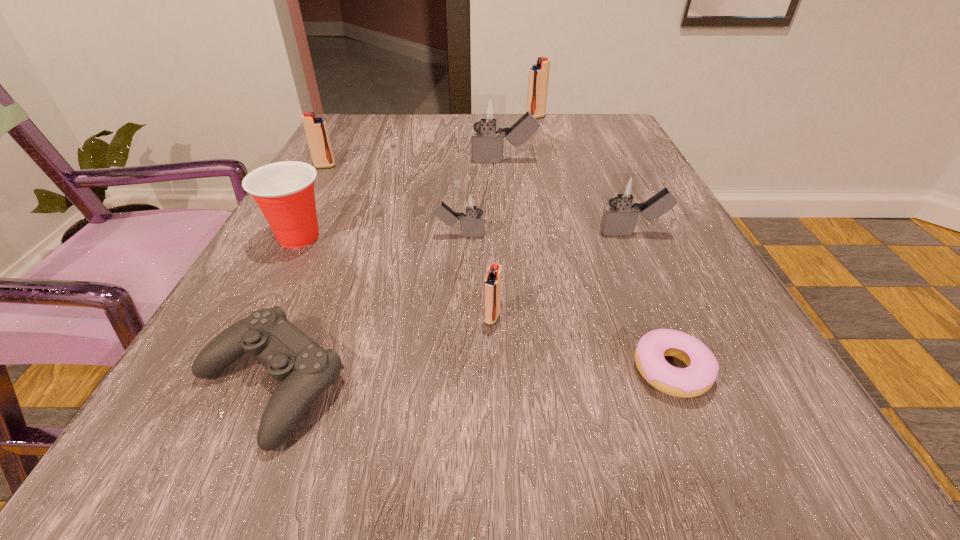
The image size is (960, 540). Find the location of `empty space that is in between the cup and the gray control`. empty space that is in between the cup and the gray control is located at coordinates (284, 310).

Where is `free space between the biggest gray igniter and the second shortest object`? The height and width of the screenshot is (540, 960). free space between the biggest gray igniter and the second shortest object is located at coordinates (387, 273).

Where is `free space between the second smallest gray igniter and the shortest object`? The width and height of the screenshot is (960, 540). free space between the second smallest gray igniter and the shortest object is located at coordinates (652, 302).

Where is `vacant point located between the rightmost igniter and the farthest gray igniter`? This screenshot has width=960, height=540. vacant point located between the rightmost igniter and the farthest gray igniter is located at coordinates (x=568, y=197).

Select which object is the sixth closest to the rightmost igniter. Please provide its 2D coordinates. Your answer should be formatted as a tuple, i.e. [(x, y)], where the tuple contains the x and y coordinates of a point satisfying the conditions above.

[(284, 191)]

Find the location of a particular element. object that is the fourth closest to the gray control is located at coordinates (702, 369).

Where is `the fifth closest igniter to the eighth tallest object`? This screenshot has width=960, height=540. the fifth closest igniter to the eighth tallest object is located at coordinates (488, 112).

The height and width of the screenshot is (540, 960). Find the location of `igniter identified as the second closest to the farthest gray igniter`. igniter identified as the second closest to the farthest gray igniter is located at coordinates (472, 203).

The width and height of the screenshot is (960, 540). In order to click on red igniter that is the third closest to the rightmost gray igniter in this screenshot , I will do `click(316, 131)`.

This screenshot has height=540, width=960. Find the location of `red igniter that is the second closest to the control`. red igniter that is the second closest to the control is located at coordinates pos(316,131).